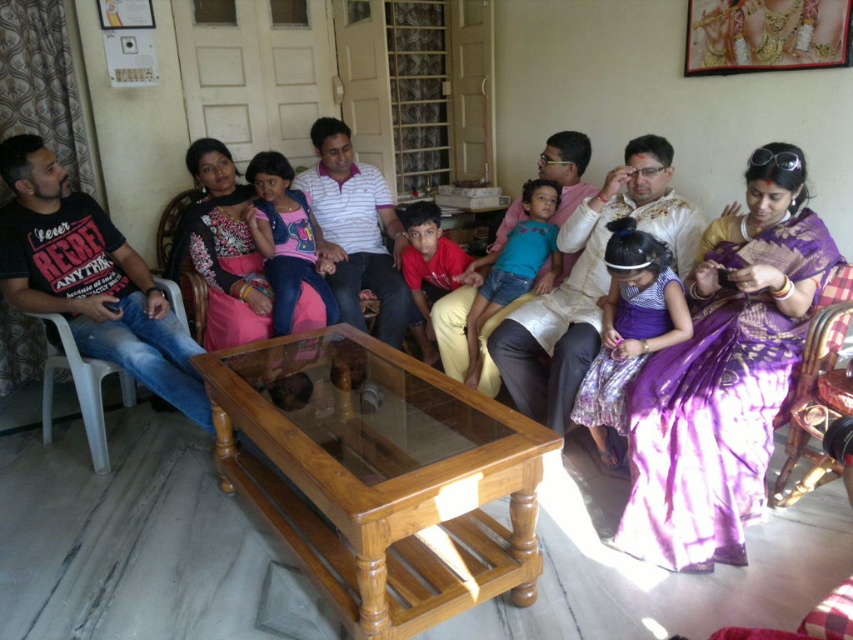
Which is more to the left, purple silk saree at center or matte pink saree at center?

From the viewer's perspective, matte pink saree at center appears more on the left side.

Is purple silk saree at center above matte pink saree at center?

No, purple silk saree at center is not above matte pink saree at center.

What do you see at coordinates (726, 374) in the screenshot?
I see `purple silk saree at center` at bounding box center [726, 374].

Where is `purple silk saree at center`? This screenshot has width=853, height=640. purple silk saree at center is located at coordinates (726, 374).